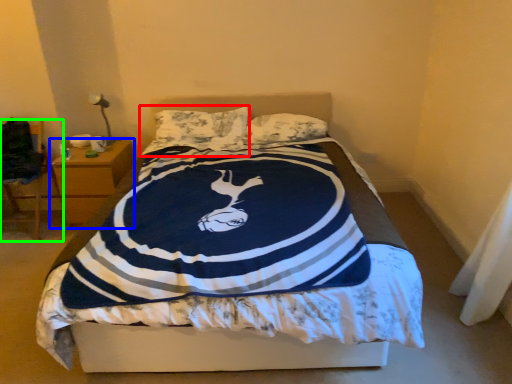
Question: Considering the real-world distances, which object is farthest from pillow (highlighted by a red box)? nightstand (highlighted by a blue box) or chair (highlighted by a green box)?

Choices:
 (A) nightstand
 (B) chair

Answer: (B)